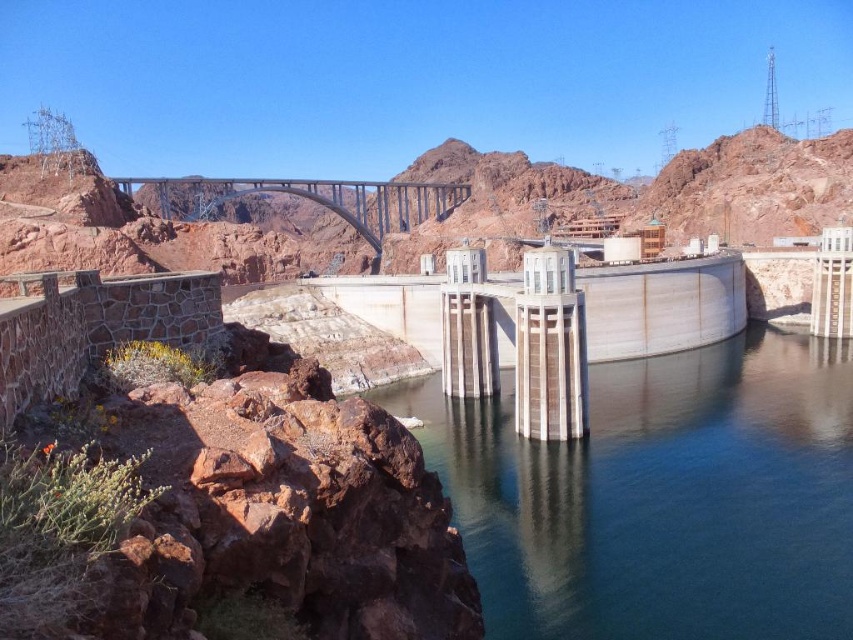
You are a tour guide leading a group near the Hoover Dam. You want to inform visitors about the distance between the clear blue water at center and the metallic gray bridge at center. What do you tell them?

The clear blue water at center and the metallic gray bridge at center are separated by a distance of 461.92 feet.

You are standing at the observation deck overlooking the Hoover Dam. You notice two points marked on the landscape. The first point is at coordinates point (602, 515) and the second is at point (405, 209). From your vantage point, which point is closer to you?

Point (602, 515) is in front of point (405, 209), so it is closer to you.

You are a tourist standing at the Hoover Dam and want to take a photo of the clear blue water at center and the metallic gray bridge at center. Which object should you point your camera downward to capture?

You should point your camera downward to capture the clear blue water at center because it is located below the metallic gray bridge at center.